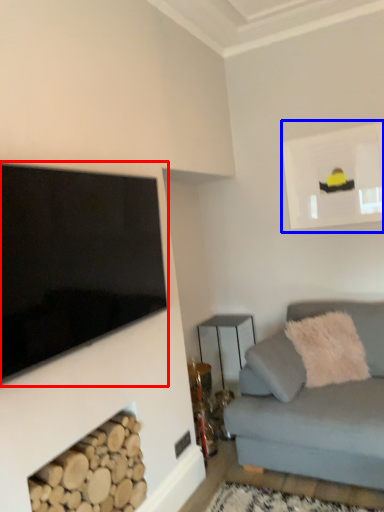
Question: Which point is closer to the camera, television (highlighted by a red box) or picture frame (highlighted by a blue box)?

Choices:
 (A) television
 (B) picture frame

Answer: (A)